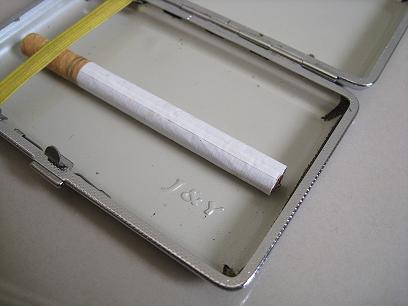
Locate an element on the screen. This screenshot has width=408, height=306. tray shadow is located at coordinates (113, 230), (18, 160).